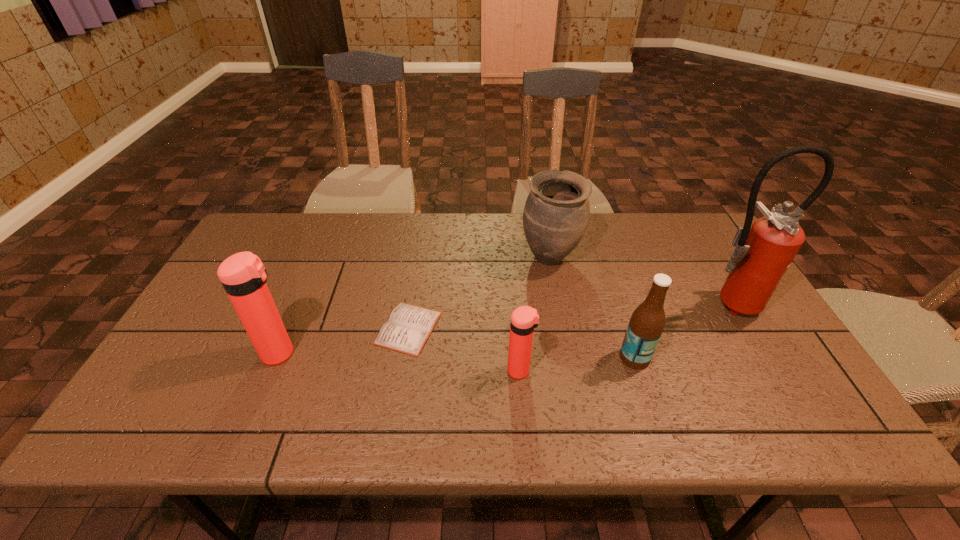
Locate an element on the screen. the left thermos bottle is located at coordinates (243, 275).

You are a GUI agent. You are given a task and a screenshot of the screen. Output one action in this format:
    pyautogui.click(x=<x>, y=<y>)
    Task: Click on the leftmost object
    This screenshot has height=540, width=960.
    Given the screenshot: What is the action you would take?
    (x=243, y=275)

The image size is (960, 540). I want to click on the second shortest object, so coord(524,319).

You are a GUI agent. You are given a task and a screenshot of the screen. Output one action in this format:
    pyautogui.click(x=<x>, y=<y>)
    Task: Click on the shorter thermos bottle
    This screenshot has height=540, width=960.
    Given the screenshot: What is the action you would take?
    pyautogui.click(x=524, y=319)

I want to click on urn, so click(x=556, y=214).

You are a GUI agent. You are given a task and a screenshot of the screen. Output one action in this format:
    pyautogui.click(x=<x>, y=<y>)
    Task: Click on the second object from left to right
    The image size is (960, 540).
    Given the screenshot: What is the action you would take?
    pyautogui.click(x=408, y=327)

Locate an element on the screen. The image size is (960, 540). the shortest object is located at coordinates (408, 327).

You are a GUI agent. You are given a task and a screenshot of the screen. Output one action in this format:
    pyautogui.click(x=<x>, y=<y>)
    Task: Click on the fifth object from left to right
    
    Given the screenshot: What is the action you would take?
    pyautogui.click(x=647, y=322)

Image resolution: width=960 pixels, height=540 pixels. In order to click on the rightmost object in this screenshot , I will do `click(763, 253)`.

Where is `the tallest object`? the tallest object is located at coordinates (763, 253).